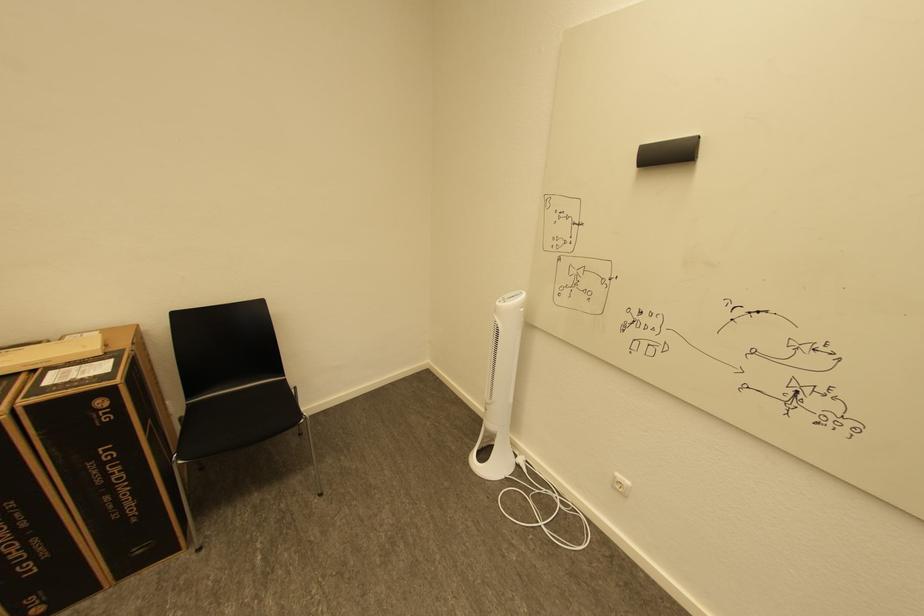
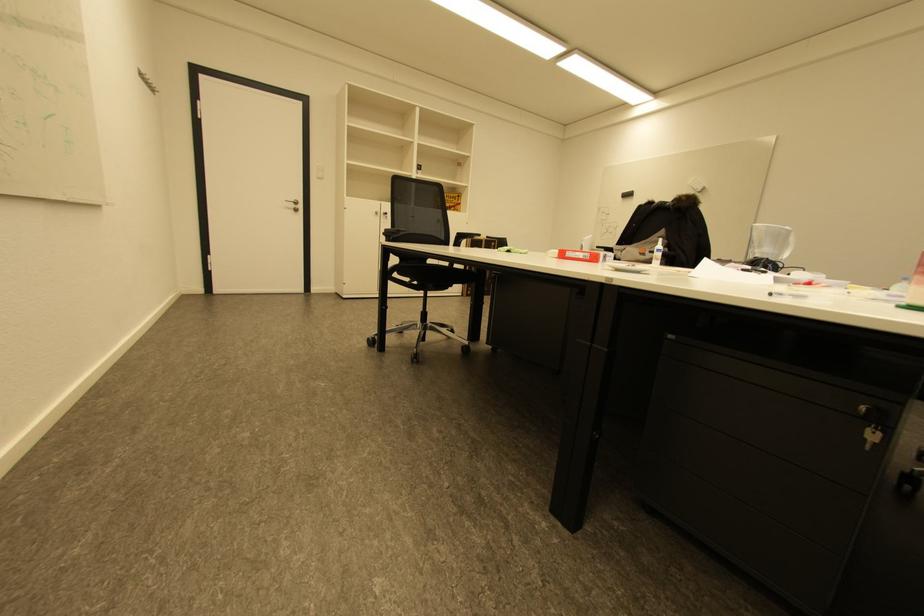
Question: Which direction would the cameraman need to move to produce the second image? Reply with the corresponding letter.

Choices:
 (A) Left
 (B) Right
 (C) Forward
 (D) Backward

Answer: (D)